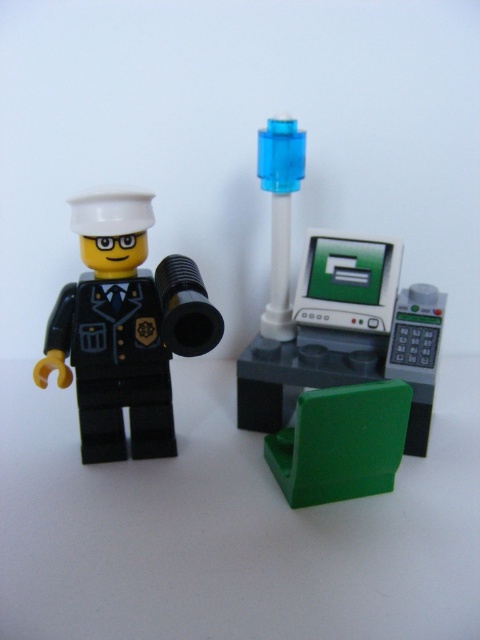
Is point (147, 436) closer to camera compared to point (296, 145)?

No, (147, 436) is further to viewer.

Which is more to the right, black matte minifigure at left or transparent blue cylinder at center?

transparent blue cylinder at center is more to the right.

Measure the distance between point (132,358) and camera.

Point (132,358) and camera are 3.57 feet apart from each other.

Where is `black matte minifigure at left`? The height and width of the screenshot is (640, 480). black matte minifigure at left is located at coordinates (124, 328).

Which of these two, green plastic chair at lower center or transparent blue cylinder at center, stands shorter?

green plastic chair at lower center

Is green plastic chair at lower center positioned in front of transparent blue cylinder at center?

Yes, green plastic chair at lower center is in front of transparent blue cylinder at center.

What do you see at coordinates (340, 442) in the screenshot?
I see `green plastic chair at lower center` at bounding box center [340, 442].

Locate an element on the screen. green plastic chair at lower center is located at coordinates (340, 442).

The image size is (480, 640). Describe the element at coordinates (124, 328) in the screenshot. I see `black matte minifigure at left` at that location.

Looking at this image, does black matte minifigure at left have a larger size compared to green plastic chair at lower right?

Yes.

Is point (87, 305) positioned after point (360, 346)?

No.

Locate an element on the screen. The width and height of the screenshot is (480, 640). black matte minifigure at left is located at coordinates (124, 328).